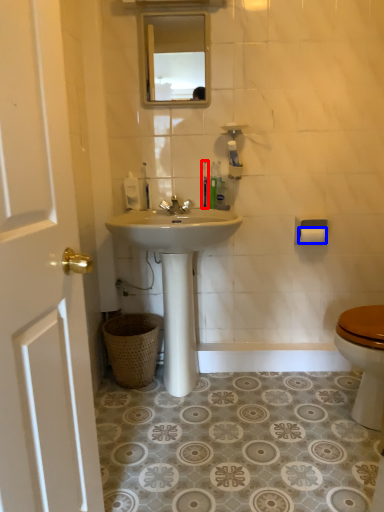
Question: Which point is closer to the camera, toothbrush (highlighted by a red box) or toilet paper (highlighted by a blue box)?

Choices:
 (A) toothbrush
 (B) toilet paper

Answer: (A)